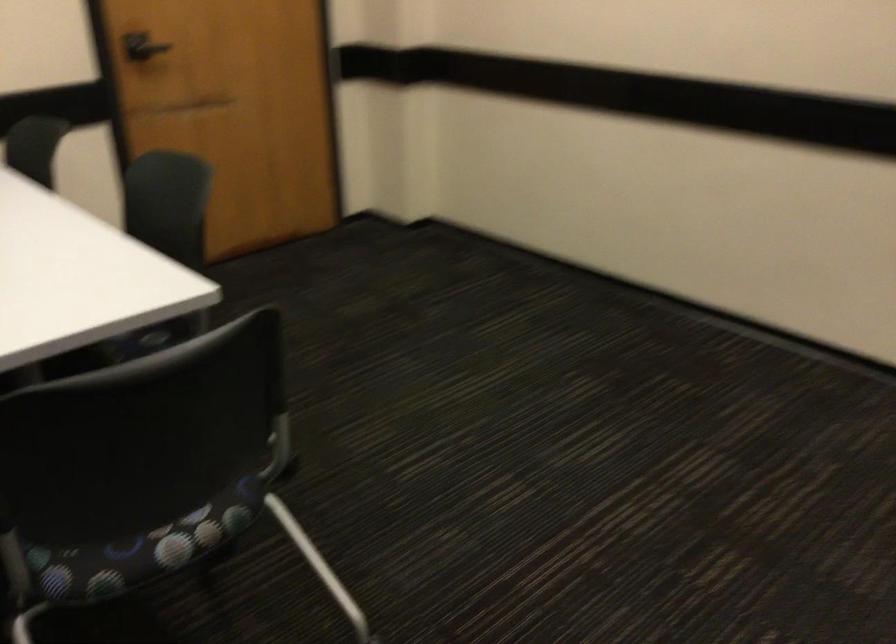
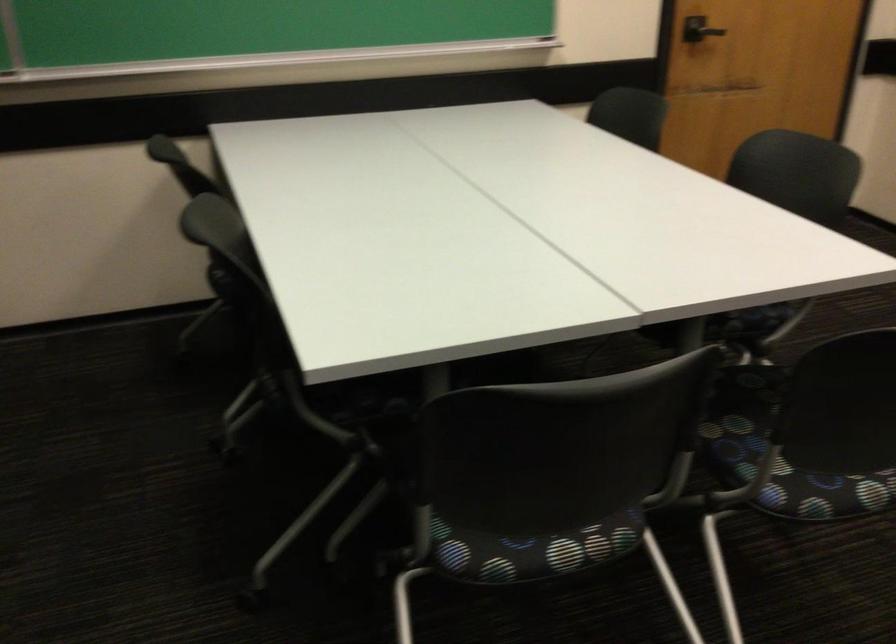
What movement of the cameraman would produce the second image?

The cameraman walked toward left, backward.